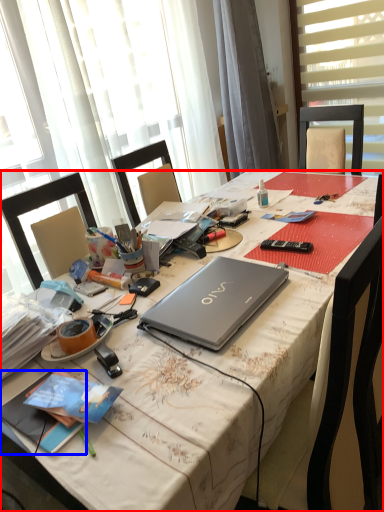
Question: Among these objects, which one is farthest to the camera, desk (highlighted by a red box) or book (highlighted by a blue box)?

Choices:
 (A) desk
 (B) book

Answer: (B)